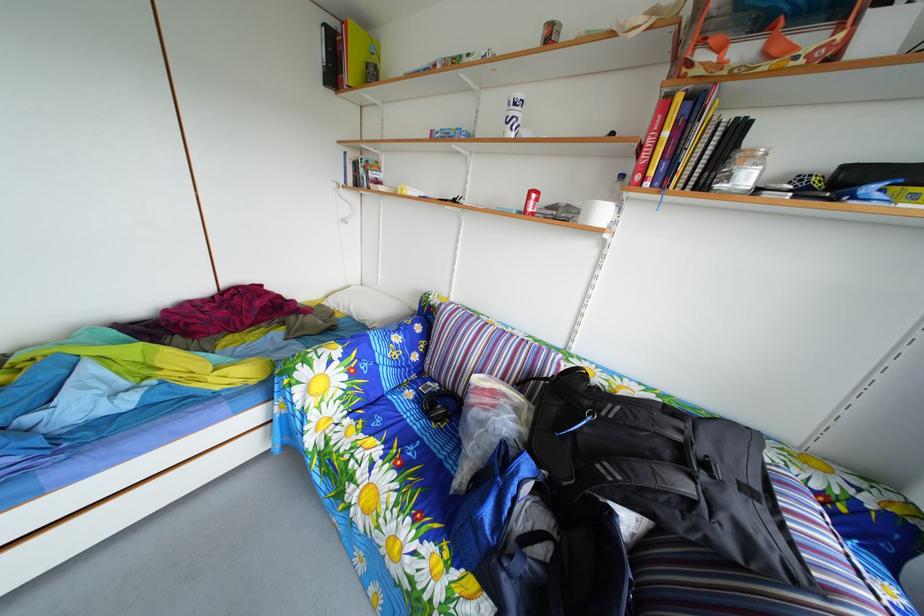
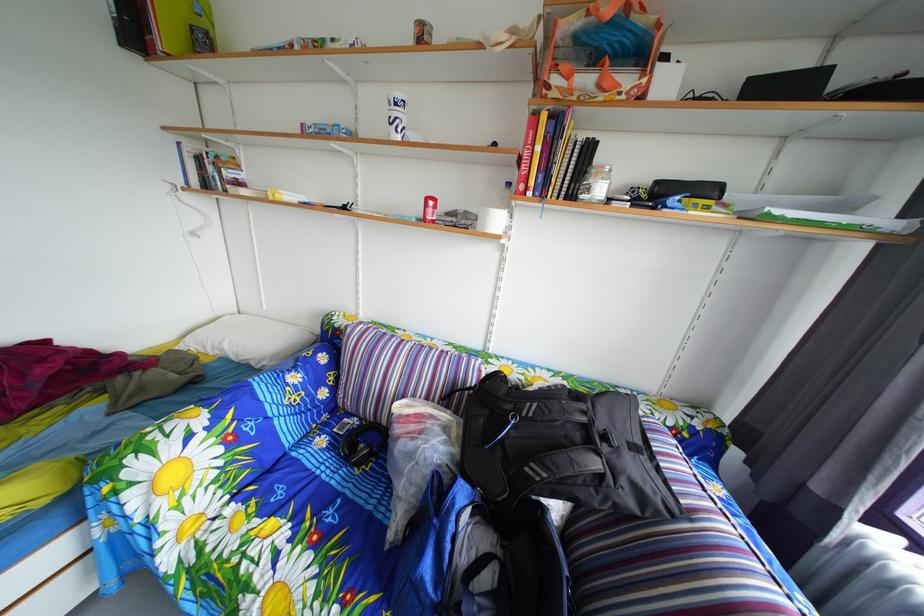
The point at (x=447, y=394) is marked in the first image. Where is the corresponding point in the second image?

(367, 428)